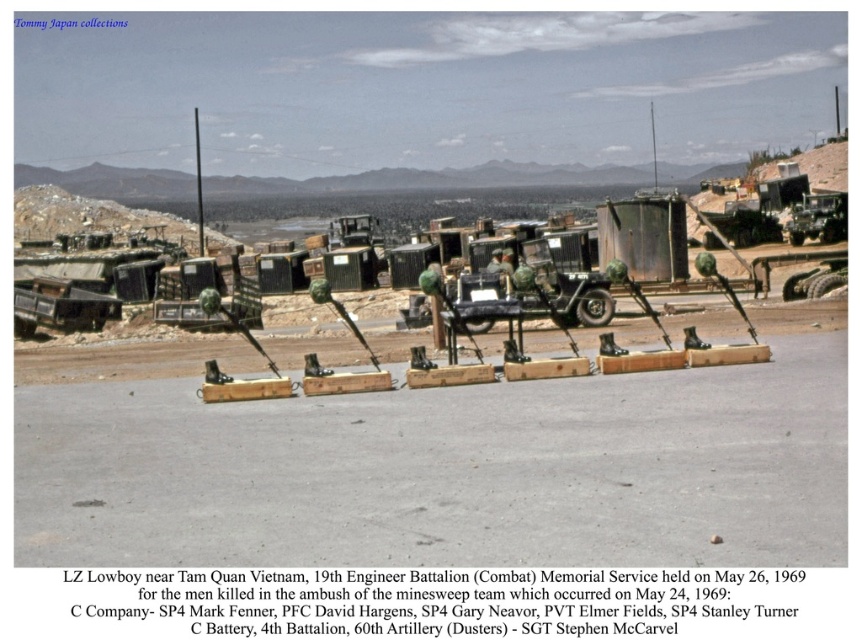
Find the location of `matte black truck at left`. matte black truck at left is located at coordinates (60, 307).

Does matte black truck at left appear on the right side of matte green military vehicle at right?

In fact, matte black truck at left is to the left of matte green military vehicle at right.

Which is behind, point (119, 300) or point (823, 221)?

Positioned behind is point (823, 221).

Find the location of a particular element. matte black truck at left is located at coordinates (60, 307).